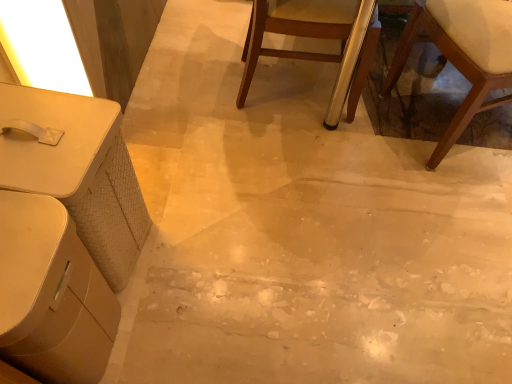
You are a GUI agent. You are given a task and a screenshot of the screen. Output one action in this format:
    pyautogui.click(x=<x>, y=<y>)
    Task: Click on the vacant region in front of wooden chair with white cushion at lower right, which is counted as the second chair, starting from the left
    The height and width of the screenshot is (384, 512).
    Given the screenshot: What is the action you would take?
    pyautogui.click(x=456, y=214)